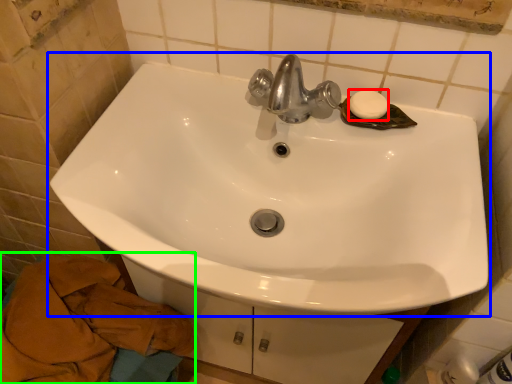
Question: Based on their relative distances, which object is farther from soap (highlighted by a red box)? Choose from sink (highlighted by a blue box) and bath towel (highlighted by a green box).

Choices:
 (A) sink
 (B) bath towel

Answer: (B)